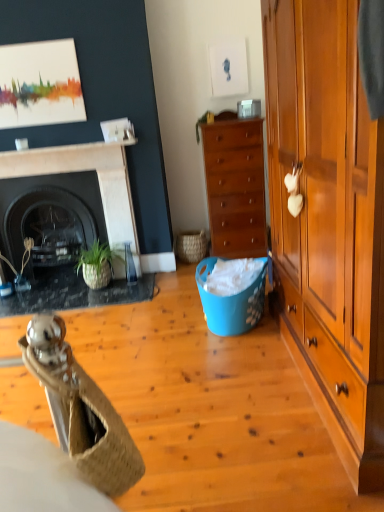
Question: Is matte black fireplace at left in front of black glossy fireplace at left, acting as the first fireplace starting from the back?

Choices:
 (A) yes
 (B) no

Answer: (A)

Question: From the image's perspective, would you say matte black fireplace at left is shown under black glossy fireplace at left, acting as the first fireplace starting from the back?

Choices:
 (A) no
 (B) yes

Answer: (B)

Question: Is there a large distance between matte black fireplace at left and black glossy fireplace at left, acting as the first fireplace starting from the back?

Choices:
 (A) yes
 (B) no

Answer: (B)

Question: Is black glossy fireplace at left, acting as the first fireplace starting from the back, completely or partially inside matte black fireplace at left?

Choices:
 (A) no
 (B) yes

Answer: (A)

Question: Does matte black fireplace at left have a greater width compared to black glossy fireplace at left, acting as the first fireplace starting from the back?

Choices:
 (A) no
 (B) yes

Answer: (B)

Question: Is matte black fireplace at left directly adjacent to black glossy fireplace at left, which is counted as the 2th fireplace, starting from the front?

Choices:
 (A) yes
 (B) no

Answer: (B)

Question: Is black marble fireplace at left, the second fireplace from the back, positioned in front of woven straw chair at lower left?

Choices:
 (A) yes
 (B) no

Answer: (B)

Question: Considering the relative sizes of black marble fireplace at left, the second fireplace from the back, and woven straw chair at lower left in the image provided, is black marble fireplace at left, the second fireplace from the back, smaller than woven straw chair at lower left?

Choices:
 (A) yes
 (B) no

Answer: (B)

Question: Considering the relative positions of black marble fireplace at left, the second fireplace from the back, and woven straw chair at lower left in the image provided, is black marble fireplace at left, the second fireplace from the back, to the left of woven straw chair at lower left from the viewer's perspective?

Choices:
 (A) yes
 (B) no

Answer: (A)

Question: From a real-world perspective, is black marble fireplace at left, positioned as the first fireplace in front-to-back order, on top of woven straw chair at lower left?

Choices:
 (A) no
 (B) yes

Answer: (A)

Question: From the image's perspective, is black marble fireplace at left, the second fireplace from the back, below woven straw chair at lower left?

Choices:
 (A) no
 (B) yes

Answer: (A)

Question: Does black marble fireplace at left, positioned as the first fireplace in front-to-back order, appear on the right side of woven straw chair at lower left?

Choices:
 (A) no
 (B) yes

Answer: (A)

Question: Is blue plastic laundry basket at center completely or partially inside woven straw chair at lower left?

Choices:
 (A) yes
 (B) no

Answer: (B)